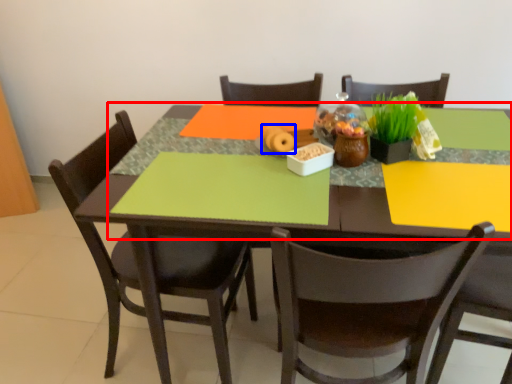
Question: Which point is closer to the camera, tablecloth (highlighted by a red box) or food (highlighted by a blue box)?

Choices:
 (A) tablecloth
 (B) food

Answer: (A)